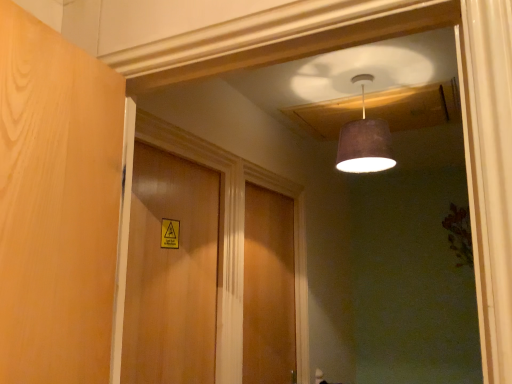
Question: Does wooden door at center, the first door in the right-to-left sequence, have a smaller size compared to matte brown lampshade at upper center?

Choices:
 (A) no
 (B) yes

Answer: (A)

Question: Is wooden door at center, arranged as the second door when viewed from the left, bigger than matte brown lampshade at upper center?

Choices:
 (A) yes
 (B) no

Answer: (A)

Question: Is wooden door at center, placed as the first door when sorted from back to front, positioned beyond the bounds of matte brown lampshade at upper center?

Choices:
 (A) no
 (B) yes

Answer: (B)

Question: Is matte brown lampshade at upper center at the back of wooden door at center, arranged as the second door when viewed from the left?

Choices:
 (A) yes
 (B) no

Answer: (B)

Question: Considering the relative sizes of wooden door at center, placed as the first door when sorted from back to front, and matte brown lampshade at upper center in the image provided, is wooden door at center, placed as the first door when sorted from back to front, thinner than matte brown lampshade at upper center?

Choices:
 (A) no
 (B) yes

Answer: (B)

Question: Is wooden door at center, acting as the 2th door starting from the back, in front of or behind matte brown lampshade at upper center in the image?

Choices:
 (A) behind
 (B) front

Answer: (B)

Question: Is wooden door at center, placed as the second door when sorted from right to left, inside or outside of matte brown lampshade at upper center?

Choices:
 (A) outside
 (B) inside

Answer: (A)

Question: Considering the positions of point (162, 370) and point (337, 150), is point (162, 370) closer or farther from the camera than point (337, 150)?

Choices:
 (A) farther
 (B) closer

Answer: (B)

Question: From a real-world perspective, is wooden door at center, acting as the 2th door starting from the back, positioned above or below matte brown lampshade at upper center?

Choices:
 (A) below
 (B) above

Answer: (A)

Question: Is wooden door at center, placed as the second door when sorted from right to left, wider or thinner than wooden door at center, arranged as the second door when viewed from the left?

Choices:
 (A) thin
 (B) wide

Answer: (A)

Question: Is wooden door at center, the first door positioned from the front, inside or outside of wooden door at center, the 2th door from the front?

Choices:
 (A) inside
 (B) outside

Answer: (B)

Question: Looking at the image, does wooden door at center, the first door viewed from the left, seem bigger or smaller compared to wooden door at center, the 2th door from the front?

Choices:
 (A) big
 (B) small

Answer: (B)

Question: Based on their positions, is wooden door at center, acting as the 2th door starting from the back, located to the left or right of wooden door at center, the 2th door from the front?

Choices:
 (A) left
 (B) right

Answer: (A)

Question: In terms of width, does wooden door at center, placed as the first door when sorted from back to front, look wider or thinner when compared to matte brown lampshade at upper center?

Choices:
 (A) thin
 (B) wide

Answer: (A)

Question: Based on their positions, is wooden door at center, the 2th door from the front, located to the left or right of matte brown lampshade at upper center?

Choices:
 (A) right
 (B) left

Answer: (B)